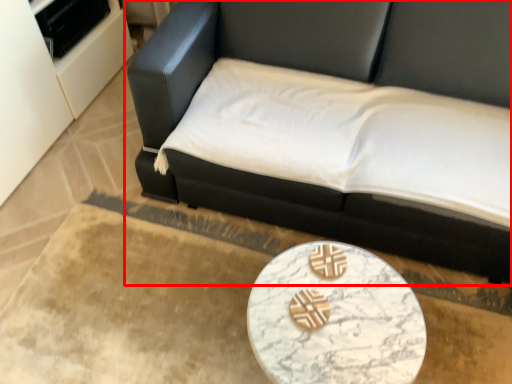
Question: From the image's perspective, considering the relative positions of studio couch (annotated by the red box) and table in the image provided, where is studio couch (annotated by the red box) located with respect to the staircase?

Choices:
 (A) above
 (B) below

Answer: (A)